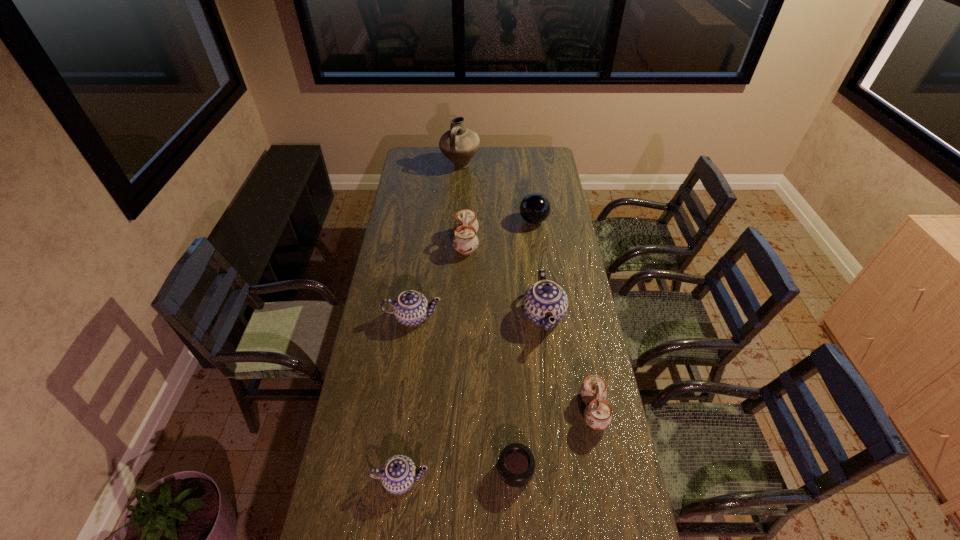
Locate an element on the screen. This screenshot has height=540, width=960. the nearest chinaware is located at coordinates (398, 474).

At what (x,y) coordinates should I click in order to perform the action: click on the fifth object from left to right. Please return your answer as a coordinate pair (x, y). Looking at the image, I should click on (516, 465).

Find the location of `telephoto lens`. telephoto lens is located at coordinates (516, 465).

The height and width of the screenshot is (540, 960). In order to click on free space located on the handle side of the farthest object in this screenshot , I will do `click(457, 217)`.

Image resolution: width=960 pixels, height=540 pixels. I want to click on vacant region located 0.220m by the handle of the left white chinaware, so click(524, 243).

This screenshot has width=960, height=540. Find the location of `vacant space located 0.300m at the spout of the rightmost blue chinaware`. vacant space located 0.300m at the spout of the rightmost blue chinaware is located at coordinates (448, 315).

The height and width of the screenshot is (540, 960). In order to click on vacant space located at the spout of the rightmost blue chinaware in this screenshot , I will do `click(466, 315)`.

The height and width of the screenshot is (540, 960). I want to click on vacant space located 0.250m at the spout of the rightmost blue chinaware, so click(461, 315).

I want to click on free space located on the side of the bowling ball with the finger holes, so click(541, 280).

The height and width of the screenshot is (540, 960). I want to click on free space located 0.130m at the spout of the second smallest blue chinaware, so click(407, 359).